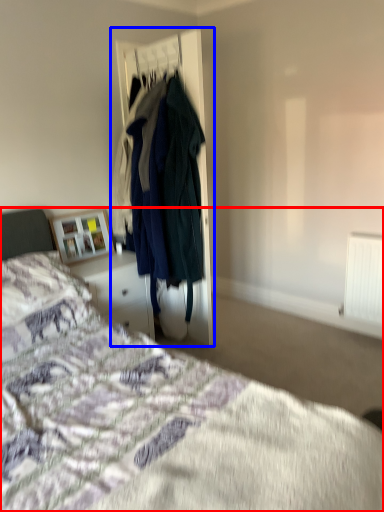
Question: Which object is closer to the camera taking this photo, bed (highlighted by a red box) or closet (highlighted by a blue box)?

Choices:
 (A) bed
 (B) closet

Answer: (A)